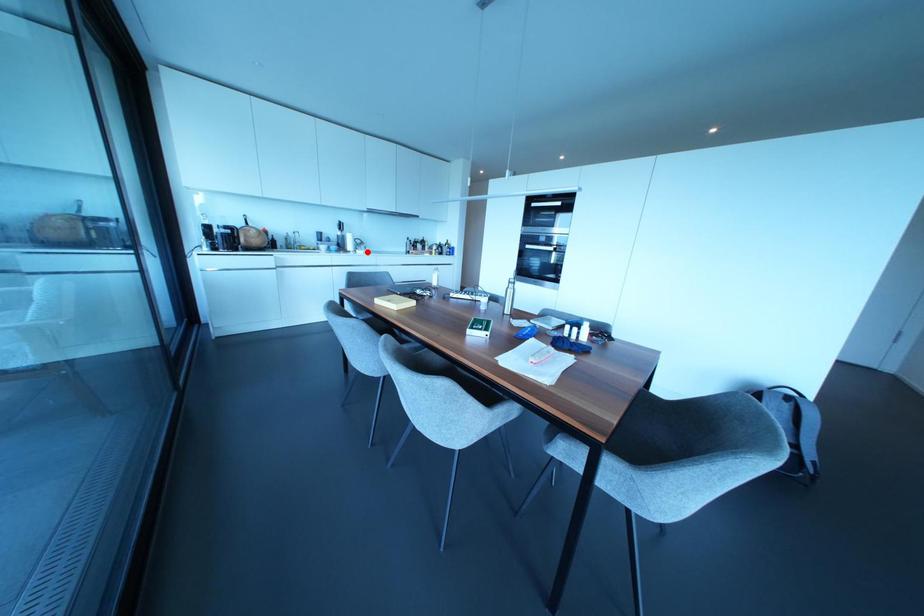
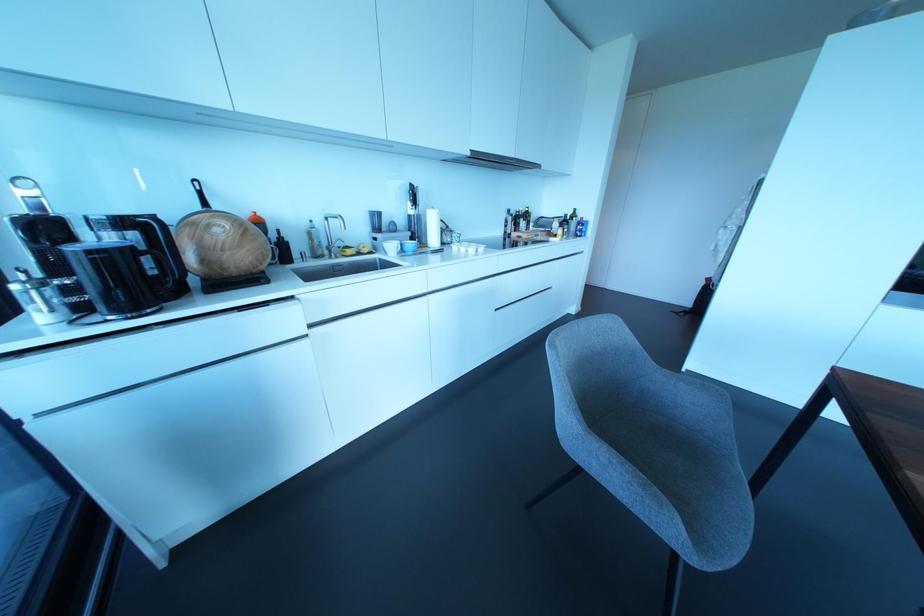
Question: A red point is marked in image1. In image2, is the corresponding 3D point closer to the camera or farther? Reply with the corresponding letter.

Choices:
 (A) The corresponding 3D point is closer.
 (B) The corresponding 3D point is farther.

Answer: (B)